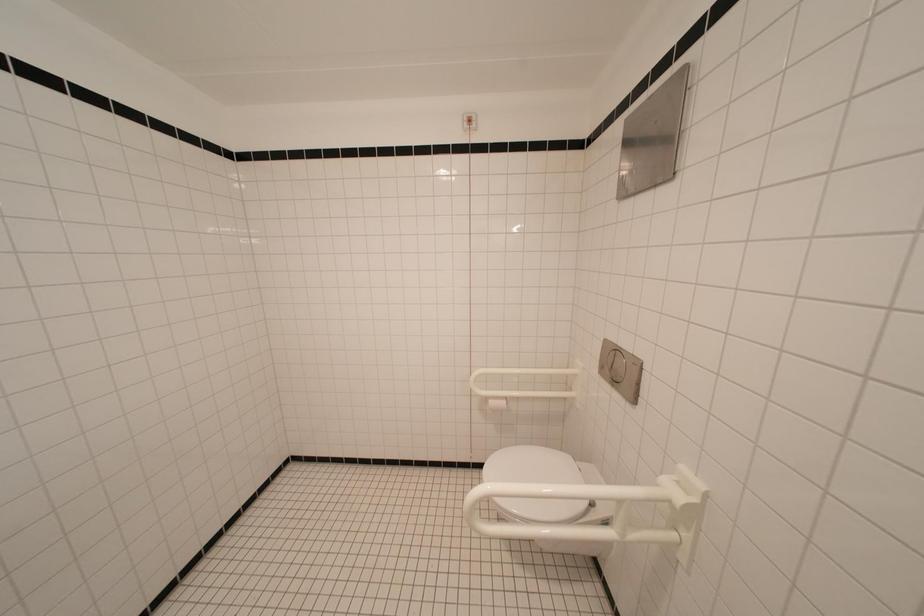
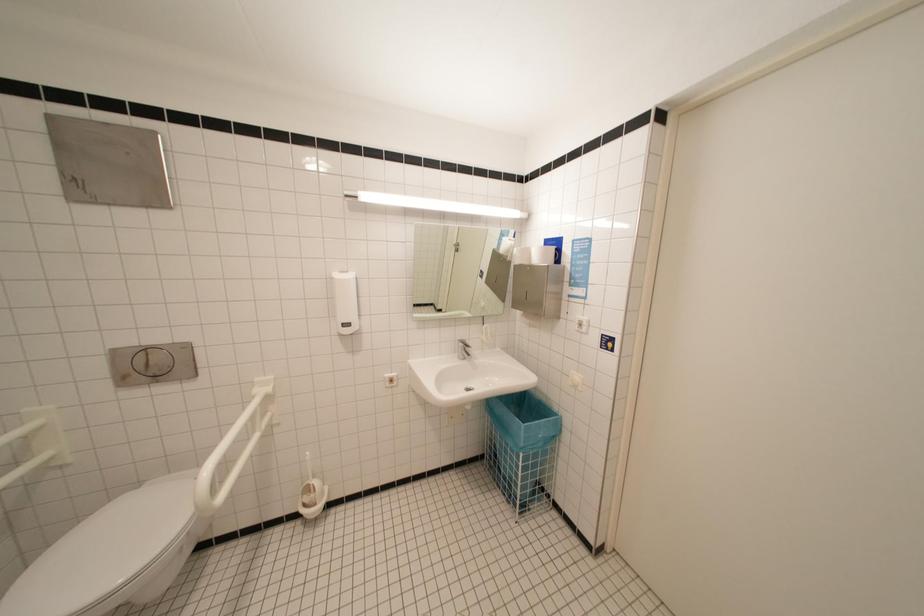
Question: The camera is either moving clockwise (left) or counter-clockwise (right) around the object. The first image is from the beginning of the video and the second image is from the end. Is the camera moving left or right when shooting the video?

Choices:
 (A) Left
 (B) Right

Answer: (A)